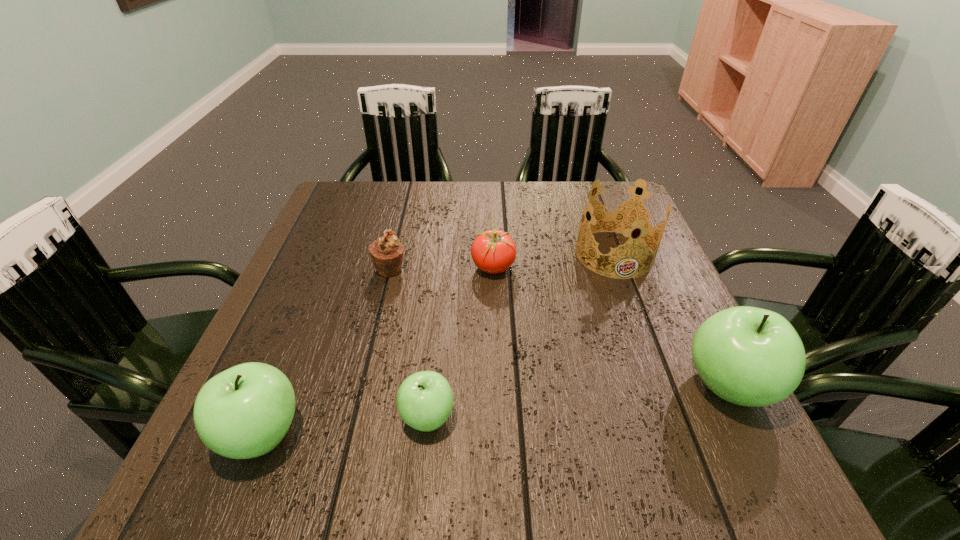
The image size is (960, 540). I want to click on free space that satisfies the following two spatial constraints: 1. on the back side of the leftmost apple; 2. on the right side of the second apple from left to right, so click(270, 417).

Identify the location of free space that satisfies the following two spatial constraints: 1. on the back side of the second shortest apple; 2. on the left side of the shortest apple. tap(270, 417).